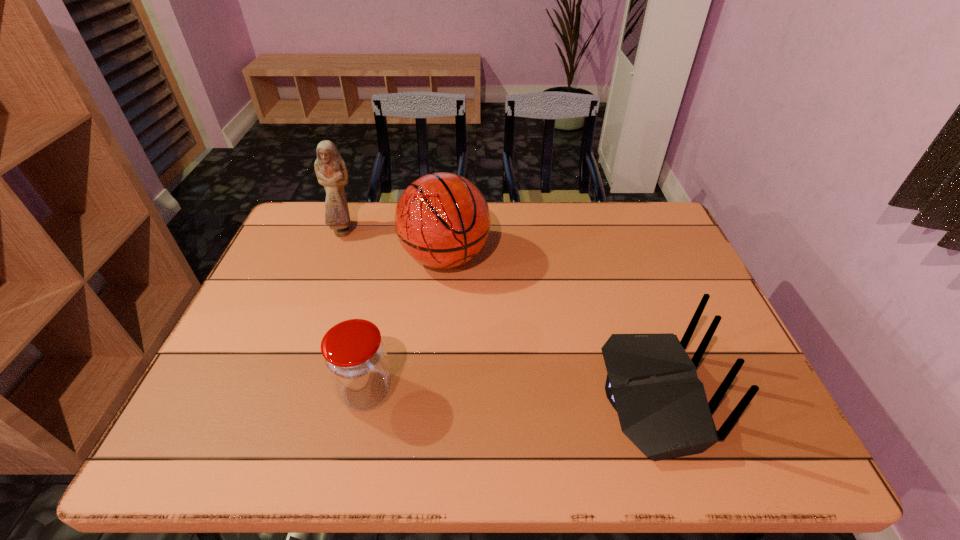
Locate an element on the screen. free point located on the front-facing side of the leftmost object is located at coordinates (378, 278).

Identify the location of basketball that is at the far edge. This screenshot has width=960, height=540. (442, 220).

You are a GUI agent. You are given a task and a screenshot of the screen. Output one action in this format:
    pyautogui.click(x=<x>, y=<y>)
    Task: Click on the figurine that is at the far edge
    
    Given the screenshot: What is the action you would take?
    pyautogui.click(x=330, y=168)

Image resolution: width=960 pixels, height=540 pixels. Identify the location of jar that is at the near edge. (354, 355).

I want to click on router that is positioned at the near edge, so click(652, 383).

Where is `object at the left edge`? The height and width of the screenshot is (540, 960). object at the left edge is located at coordinates (330, 168).

You are a GUI agent. You are given a task and a screenshot of the screen. Output one action in this format:
    pyautogui.click(x=<x>, y=<y>)
    Task: Click on the object located at the right edge
    Image resolution: width=960 pixels, height=540 pixels.
    Given the screenshot: What is the action you would take?
    pyautogui.click(x=652, y=383)

Locate an element on the screen. object situated at the far left corner is located at coordinates (330, 168).

The height and width of the screenshot is (540, 960). Find the location of `object that is at the near right corner`. object that is at the near right corner is located at coordinates (652, 383).

I want to click on vacant space at the far edge of the desktop, so click(x=379, y=208).